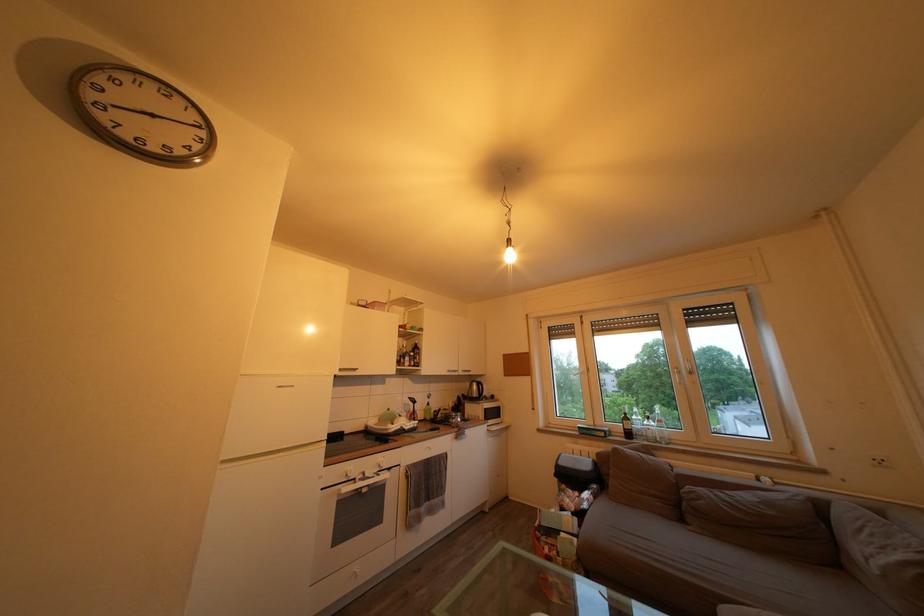
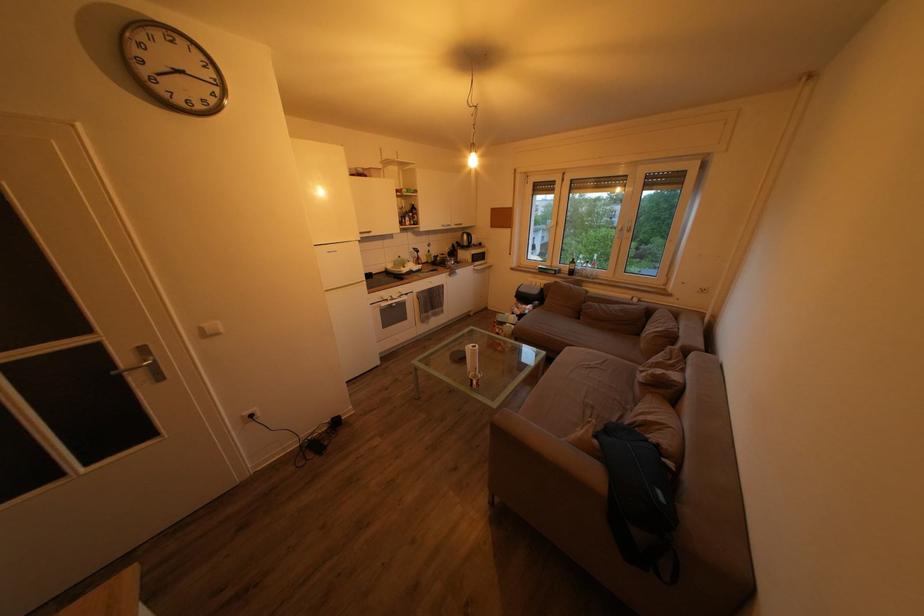
In the second image, find the point that corresponds to (x=828, y=515) in the first image.

(657, 318)